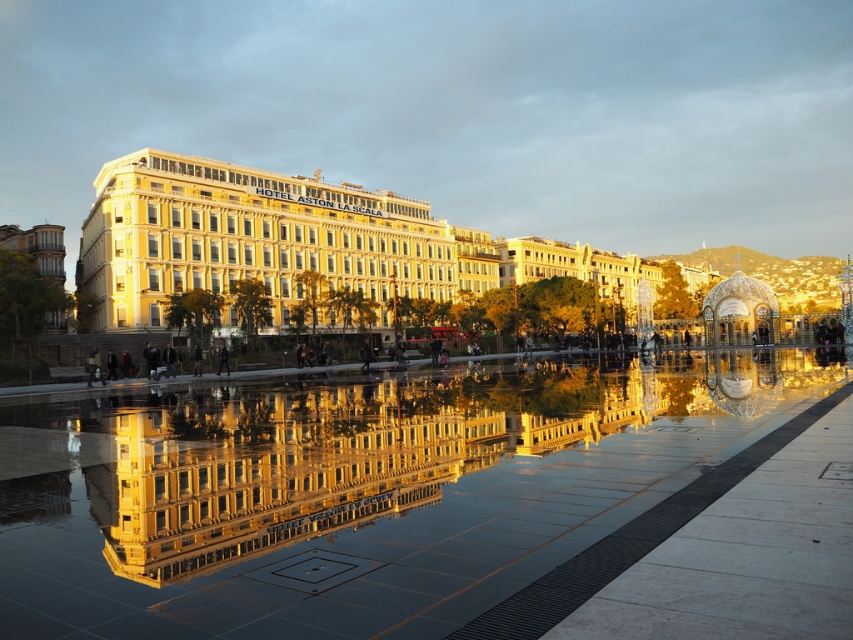
Can you confirm if glossy reflective water at center is positioned above golden stone building at center?

No.

This screenshot has width=853, height=640. Describe the element at coordinates (363, 490) in the screenshot. I see `glossy reflective water at center` at that location.

The width and height of the screenshot is (853, 640). In order to click on glossy reflective water at center in this screenshot , I will do `click(363, 490)`.